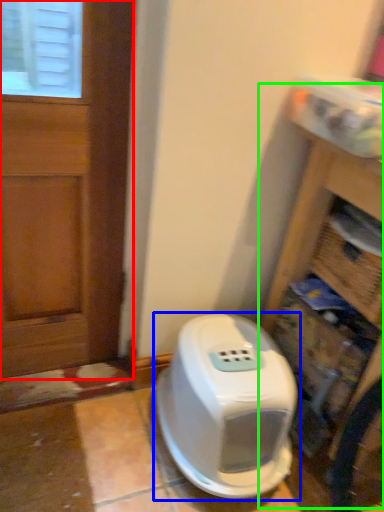
Question: Considering the real-world distances, which object is closest to door (highlighted by a red box)? home appliance (highlighted by a blue box) or bookshelf (highlighted by a green box).

Choices:
 (A) home appliance
 (B) bookshelf

Answer: (A)